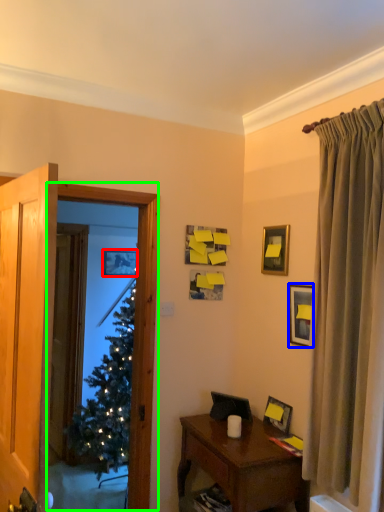
Question: Which object is positioned farthest from picture frame (highlighted by a red box)? Select from picture frame (highlighted by a blue box) and window screen (highlighted by a green box).

Choices:
 (A) picture frame
 (B) window screen

Answer: (A)